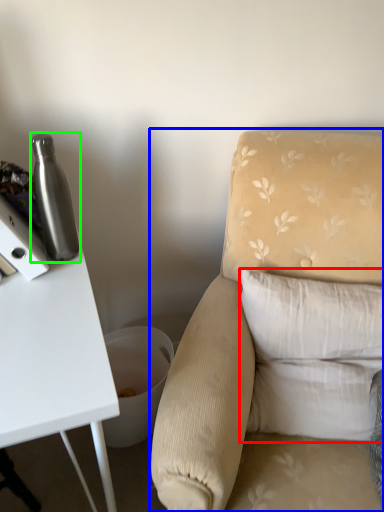
Question: Which object is the closest to the pillow (highlighted by a red box)? Choose among these: chair (highlighted by a blue box) or bottle (highlighted by a green box).

Choices:
 (A) chair
 (B) bottle

Answer: (A)